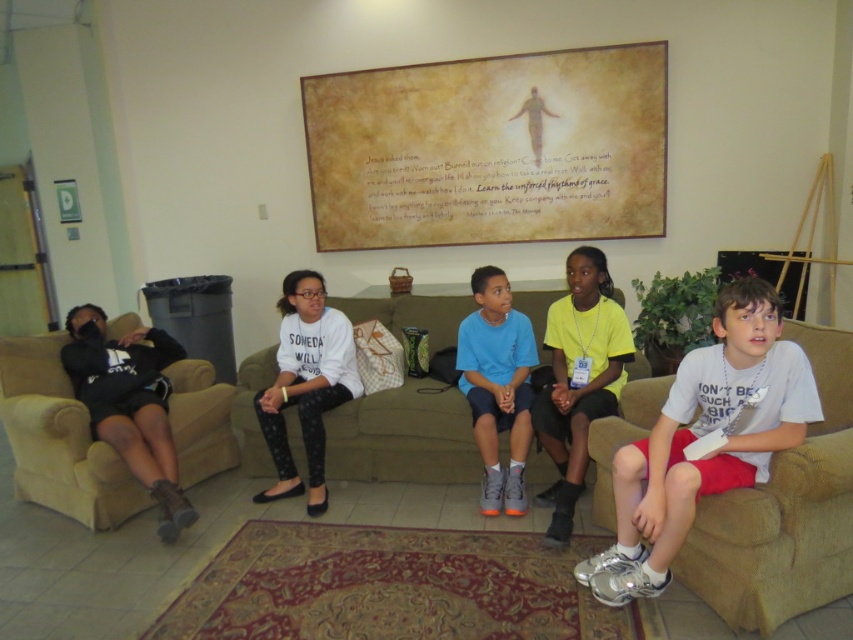
Which is more to the right, white cotton shirt at right or white matte shirt at center?

From the viewer's perspective, white cotton shirt at right appears more on the right side.

Is white cotton shirt at right bigger than white matte shirt at center?

Correct, white cotton shirt at right is larger in size than white matte shirt at center.

Which is in front, point (625, 570) or point (280, 364)?

Positioned in front is point (625, 570).

Find the location of a particular element. Image resolution: width=853 pixels, height=640 pixels. white cotton shirt at right is located at coordinates (701, 438).

Who is more forward, (723, 308) or (585, 312)?

Point (723, 308)

Who is more distant from viewer, (726, 442) or (550, 536)?

The point (550, 536) is behind.

At what (x,y) coordinates should I click in order to perform the action: click on white cotton shirt at right. Please return your answer as a coordinate pair (x, y). Looking at the image, I should click on (701, 438).

Can you confirm if black suede boots at left is bigger than white matte shirt at center?

Correct, black suede boots at left is larger in size than white matte shirt at center.

Who is higher up, black suede boots at left or white matte shirt at center?

white matte shirt at center is above.

This screenshot has height=640, width=853. What do you see at coordinates (131, 403) in the screenshot? I see `black suede boots at left` at bounding box center [131, 403].

The height and width of the screenshot is (640, 853). What are the coordinates of `black suede boots at left` in the screenshot? It's located at (131, 403).